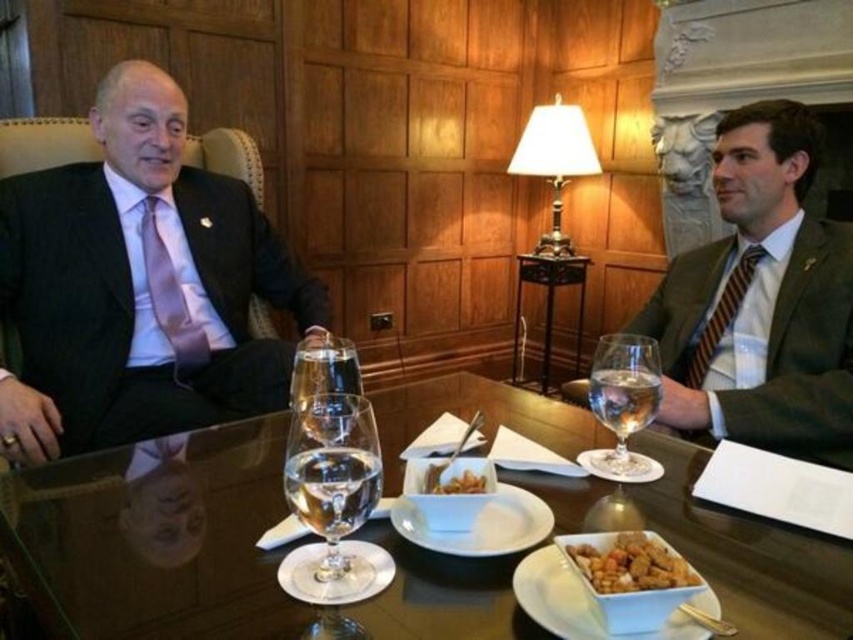
Question: Which point is closer to the camera?

Choices:
 (A) matte pink tie at left
 (B) brown crumbly bread at center

Answer: (B)

Question: Which point is farther to the camera?

Choices:
 (A) (799, 428)
 (B) (648, 577)
 (C) (221, 298)

Answer: (C)

Question: Estimate the real-world distances between objects in this image. Which object is farther from the dark suit at left?

Choices:
 (A) clear glass water at center
 (B) golden crumbly bread at center
 (C) striped wool tie at right

Answer: (B)

Question: Can you confirm if white fabric lampshade at center is positioned below clear glass water at center?

Choices:
 (A) yes
 (B) no

Answer: (B)

Question: Does dark suit at left appear under golden crumbly bread at center?

Choices:
 (A) no
 (B) yes

Answer: (A)

Question: Does striped wool tie at right come behind brown crumbly bread at center?

Choices:
 (A) yes
 (B) no

Answer: (A)